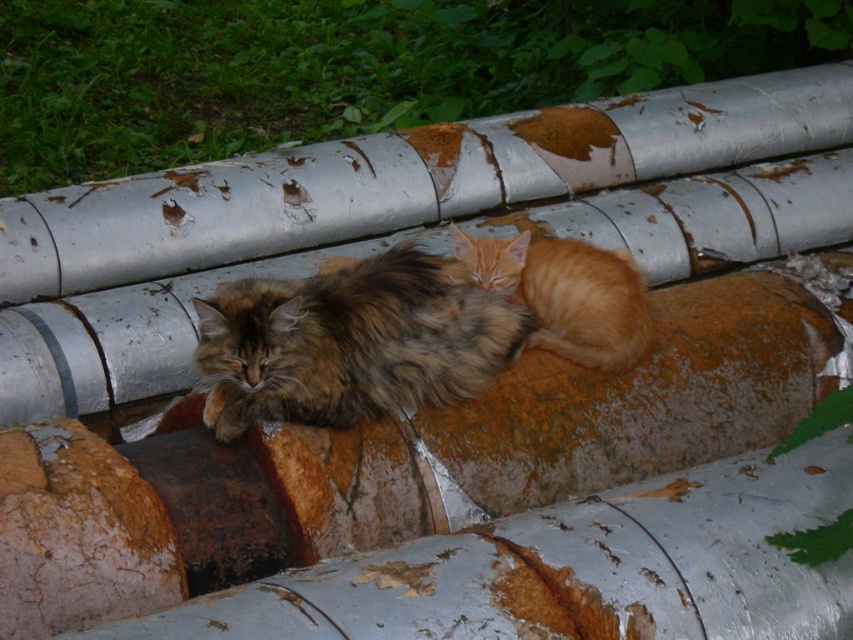
Question: Is brown fur cat at center bigger than orange fur/kitten at center?

Choices:
 (A) no
 (B) yes

Answer: (B)

Question: Which point is farther to the camera?

Choices:
 (A) (549, 300)
 (B) (410, 317)

Answer: (A)

Question: Can you confirm if brown fur cat at center is wider than orange fur/kitten at center?

Choices:
 (A) no
 (B) yes

Answer: (B)

Question: Which point is closer to the camera taking this photo?

Choices:
 (A) (363, 396)
 (B) (492, 240)

Answer: (A)

Question: Is brown fur cat at center thinner than orange fur/kitten at center?

Choices:
 (A) yes
 (B) no

Answer: (B)